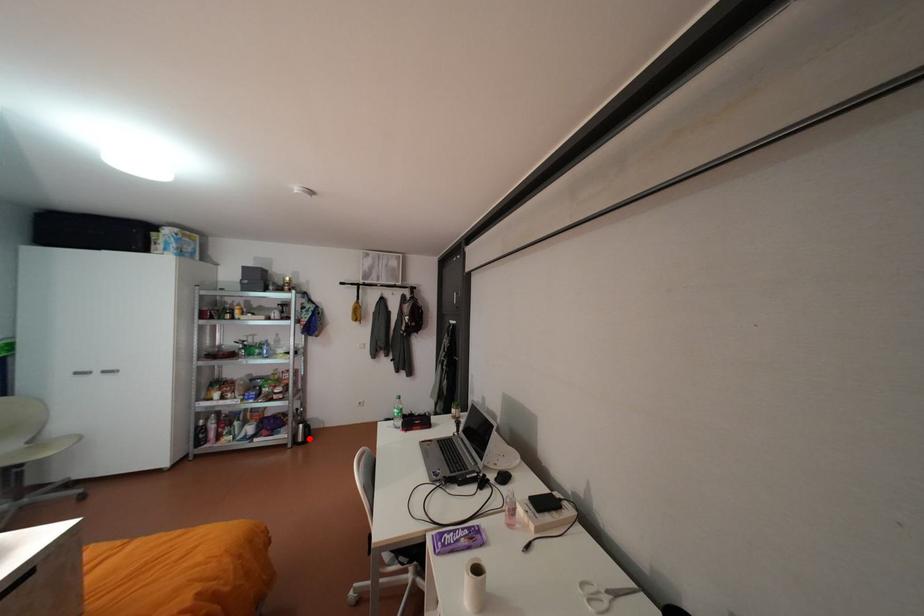
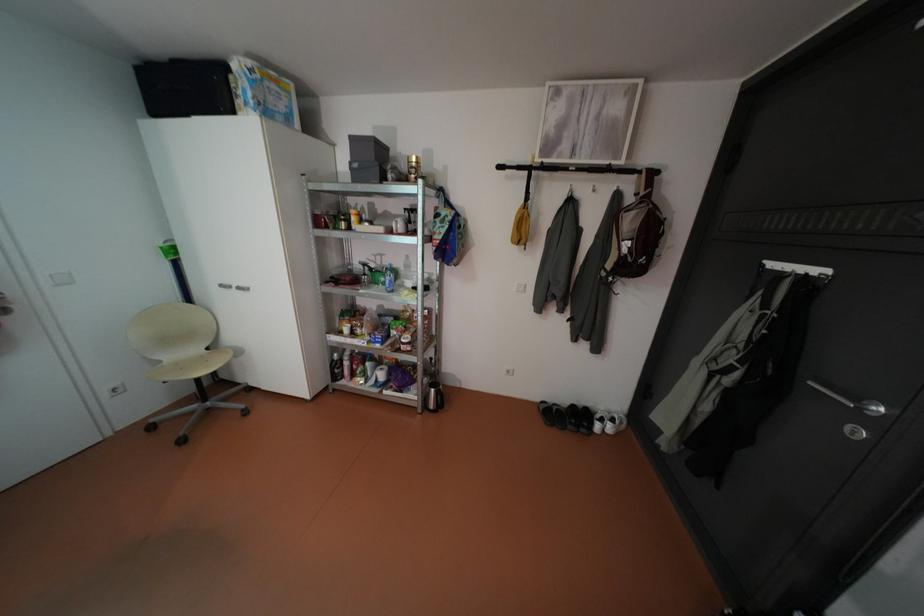
Question: I am providing you with two images of the same scene from different viewpoints. Image1 has a red point marked. In image2, the corresponding 3D location appears at what relative position? Reply with the corresponding letter.

Choices:
 (A) Closer
 (B) Farther

Answer: (B)